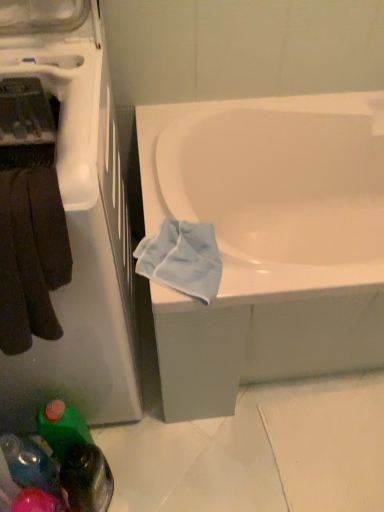
This screenshot has height=512, width=384. I want to click on free spot behind green plastic bottle at lower left, which appears as the second bottle when viewed from the left, so click(129, 435).